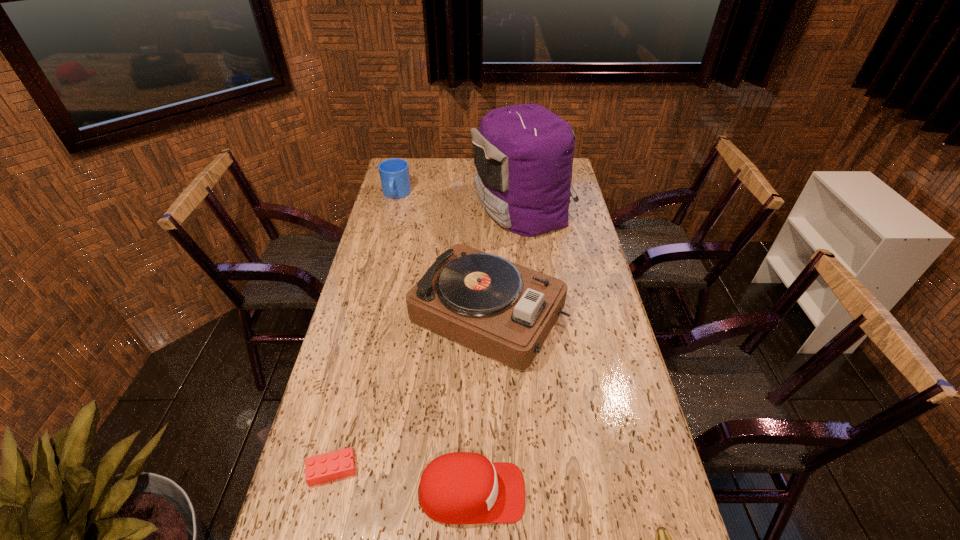
Identify the location of backpack. The width and height of the screenshot is (960, 540). (523, 154).

This screenshot has height=540, width=960. I want to click on the third farthest object, so click(501, 309).

The height and width of the screenshot is (540, 960). I want to click on the fifth shortest object, so click(501, 309).

Find the location of a particular element. The width and height of the screenshot is (960, 540). mug is located at coordinates (394, 173).

The image size is (960, 540). Identify the location of the fourth tallest object. (457, 488).

Find the location of a particular element. This screenshot has width=960, height=540. Lego is located at coordinates (339, 464).

Identify the location of vacant region located 0.100m on the front pocket of the backpack. (447, 207).

What are the coordinates of `free space located 0.230m on the front pocket of the backpack` in the screenshot? It's located at (418, 207).

Locate an element on the screen. blank space located on the front pocket of the backpack is located at coordinates (383, 207).

The image size is (960, 540). Find the location of `free spot located on the front of the second tallest object`. free spot located on the front of the second tallest object is located at coordinates (490, 394).